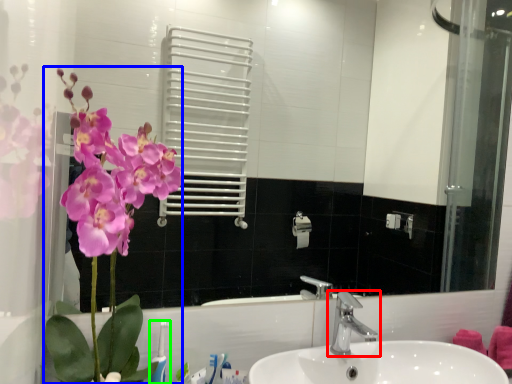
Question: Based on their relative distances, which object is nearer to tap (highlighted by a red box)? Choose from floral arrangement (highlighted by a blue box) and toothbrush (highlighted by a green box).

Choices:
 (A) floral arrangement
 (B) toothbrush

Answer: (B)